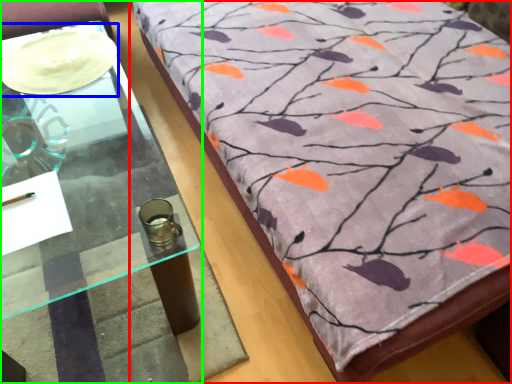
Question: Which object is the farthest from furniture (highlighted by a red box)? Choose among these: glass plate (highlighted by a blue box) or table (highlighted by a green box).

Choices:
 (A) glass plate
 (B) table

Answer: (A)